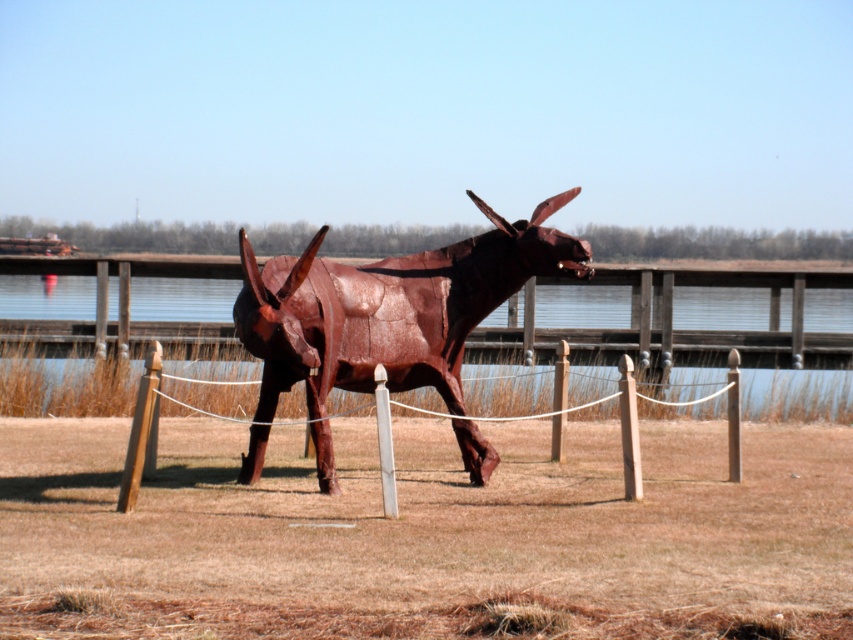
Question: Can you confirm if rusty metal bull at center is positioned below wooden post at center?

Choices:
 (A) yes
 (B) no

Answer: (B)

Question: Is rusty metal bull at center positioned behind wooden post at center?

Choices:
 (A) yes
 (B) no

Answer: (B)

Question: Is rusty metal bull at center positioned behind wooden post at center?

Choices:
 (A) no
 (B) yes

Answer: (A)

Question: Which object is farther from the camera taking this photo?

Choices:
 (A) wooden post at center
 (B) rusty metal bull at center

Answer: (A)

Question: Which point is farther from the camera taking this photo?

Choices:
 (A) (514, 259)
 (B) (730, 385)

Answer: (B)

Question: Among these points, which one is farthest from the camera?

Choices:
 (A) (312, 326)
 (B) (149, 353)

Answer: (B)